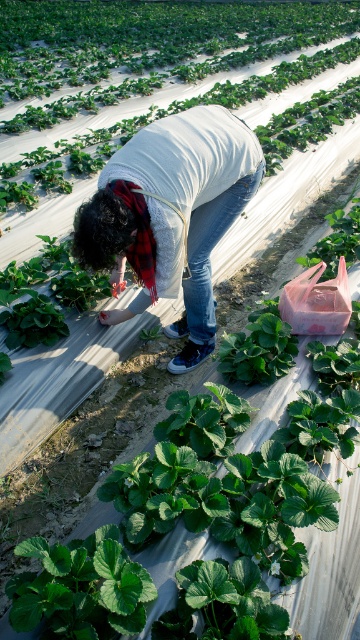
Question: Is green leafy plant at center positioned before green leafy plant at lower left?

Choices:
 (A) yes
 (B) no

Answer: (B)

Question: Which object appears closest to the camera in this image?

Choices:
 (A) pink plastic bucket at center-right
 (B) green leafy plant at lower left
 (C) green leafy plant at center

Answer: (B)

Question: Which is nearer to the pink plastic bucket at center-right?

Choices:
 (A) green leafy plant at center
 (B) denim jeans at center
 (C) green leafy plant at lower left

Answer: (B)

Question: Can you confirm if green leafy plant at lower left is positioned above pink plastic bucket at center-right?

Choices:
 (A) yes
 (B) no

Answer: (B)

Question: Which point is closer to the camera?

Choices:
 (A) green leafy plant at center
 (B) pink plastic bucket at center-right

Answer: (B)

Question: Is denim jeans at center closer to the viewer compared to pink plastic bucket at center-right?

Choices:
 (A) yes
 (B) no

Answer: (A)